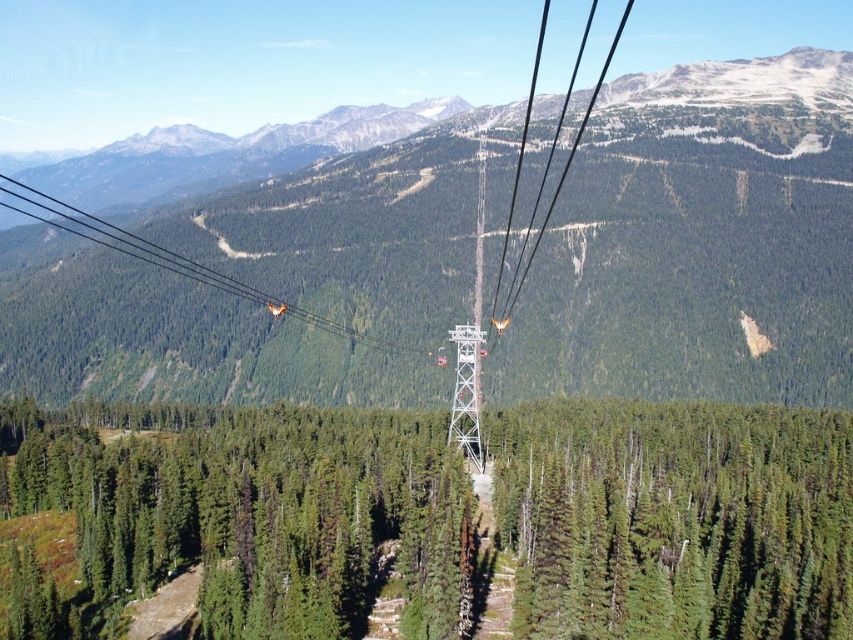
You are a passenger in the cable car and you want to know if the green matte tree at center is blocking your view of the white metallic tower at center. Can you see the tower through the tree?

The green matte tree at center is in front of the white metallic tower at center, so the tree is blocking the view of the tower.

You are a hiker planning to take a photo of the white metallic tower at center from the green matte pine forest at center. Can you see the tower from your current position in the forest?

The green matte pine forest at center is located below the white metallic tower at center, so yes, you can see the tower from the forest as it is positioned above the forest.

You are a photographer planning to capture the scenic view from the cable car. You notice two green matte objects in the center of the image. Which one is wider? The green matte pine forest at center or the green matte tree at center?

The green matte pine forest at center is wider than the green matte tree at center.